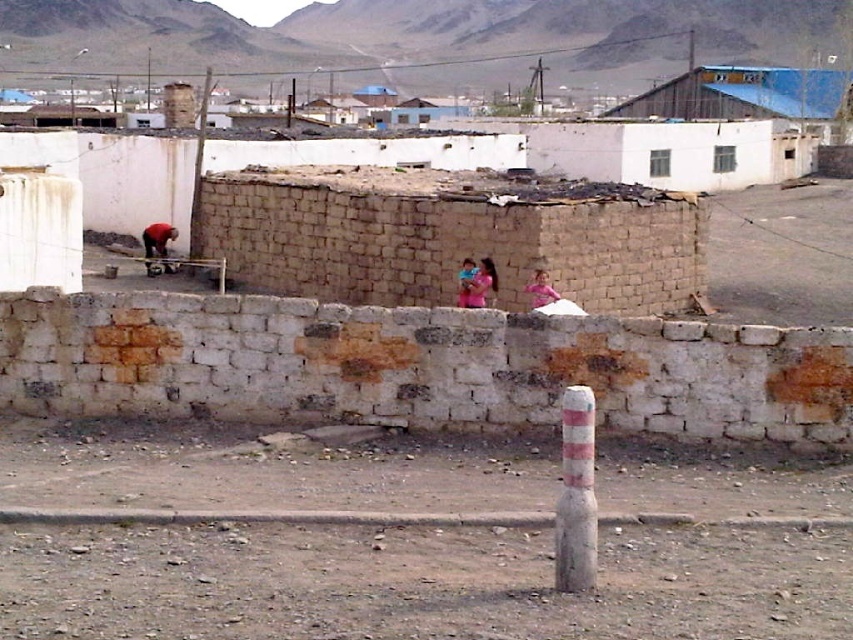
You are standing in the rural scene with the arid mountains. You notice two points marked in the image. The first point is at coordinates point (x=666, y=572) and the second point is at point (x=583, y=449). Which point is closer to your eyes?

Point (x=583, y=449) is closer to your eyes because it is less further to the camera than point (x=666, y=572).

You are standing in the rural scene described. You need to locate the pink fabric child at center. Which direction should you look relative to the white concrete pole at center?

The white concrete pole at center is to the left of the pink fabric child at center, so you should look to the right of the white concrete pole at center to find the pink fabric child at center.